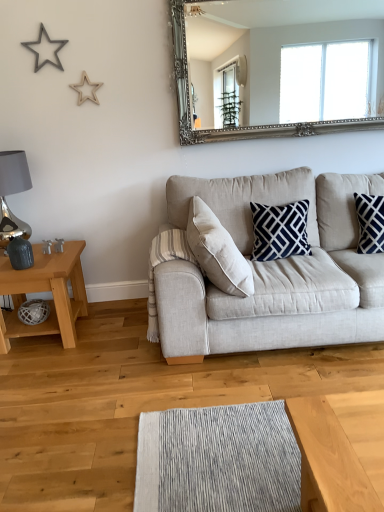
Question: Considering the relative sizes of silver ornate mirror at upper center and beige fabric couch at center in the image provided, is silver ornate mirror at upper center thinner than beige fabric couch at center?

Choices:
 (A) yes
 (B) no

Answer: (A)

Question: Is beige fabric couch at center located within silver ornate mirror at upper center?

Choices:
 (A) no
 (B) yes

Answer: (A)

Question: Does silver ornate mirror at upper center lie in front of beige fabric couch at center?

Choices:
 (A) yes
 (B) no

Answer: (B)

Question: From a real-world perspective, is silver ornate mirror at upper center on beige fabric couch at center?

Choices:
 (A) no
 (B) yes

Answer: (B)

Question: Is silver ornate mirror at upper center oriented towards beige fabric couch at center?

Choices:
 (A) no
 (B) yes

Answer: (A)

Question: From the image's perspective, is silver ornate mirror at upper center below beige fabric couch at center?

Choices:
 (A) no
 (B) yes

Answer: (A)

Question: Is matte wooden table at left shorter than beige fabric couch at center?

Choices:
 (A) no
 (B) yes

Answer: (B)

Question: Is beige fabric couch at center inside matte wooden table at left?

Choices:
 (A) no
 (B) yes

Answer: (A)

Question: Is matte wooden table at left at the right side of beige fabric couch at center?

Choices:
 (A) yes
 (B) no

Answer: (B)

Question: From the image's perspective, is matte wooden table at left over beige fabric couch at center?

Choices:
 (A) yes
 (B) no

Answer: (B)

Question: From a real-world perspective, is matte wooden table at left located beneath beige fabric couch at center?

Choices:
 (A) yes
 (B) no

Answer: (A)

Question: Is matte wooden table at left thinner than beige fabric couch at center?

Choices:
 (A) yes
 (B) no

Answer: (A)

Question: Can you confirm if beige fabric couch at center is positioned to the left of silver ornate mirror at upper center?

Choices:
 (A) yes
 (B) no

Answer: (B)